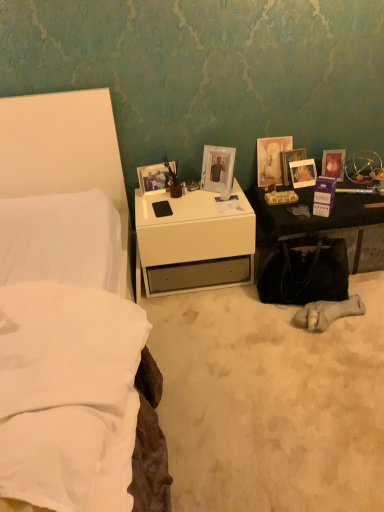
Question: Considering the relative positions of matte glass picture frame at right, which appears as the 1th picture frame when viewed from the right, and black leather handbag at lower right in the image provided, is matte glass picture frame at right, which appears as the 1th picture frame when viewed from the right, to the left or to the right of black leather handbag at lower right?

Choices:
 (A) right
 (B) left

Answer: (A)

Question: Considering their positions, is matte glass picture frame at right, which appears as the 1th picture frame when viewed from the right, located in front of or behind black leather handbag at lower right?

Choices:
 (A) front
 (B) behind

Answer: (B)

Question: Which is nearer to the black leather handbag at lower right?

Choices:
 (A) white glossy nightstand at lower left
 (B) matte wooden picture frame at upper center, the 6th picture frame when ordered from right to left
 (C) matte glass picture frame at right, which appears as the 1th picture frame when viewed from the right
 (D) matte glass picture frame at upper right, which is the fourth picture frame from right to left
 (E) matte plastic picture frame at center right, the 2th picture frame when ordered from right to left

Answer: (A)

Question: Which object is the farthest from the matte plastic picture frame at center right, the 2th picture frame when ordered from right to left?

Choices:
 (A) matte glass picture frame at upper right, which is the third picture frame from left to right
 (B) matte glass photo frame at upper right, the third picture frame from the right
 (C) white glossy picture frame at center, positioned as the 5th picture frame in right-to-left order
 (D) matte glass picture frame at right, which appears as the 1th picture frame when viewed from the right
 (E) white glossy nightstand at lower left

Answer: (E)